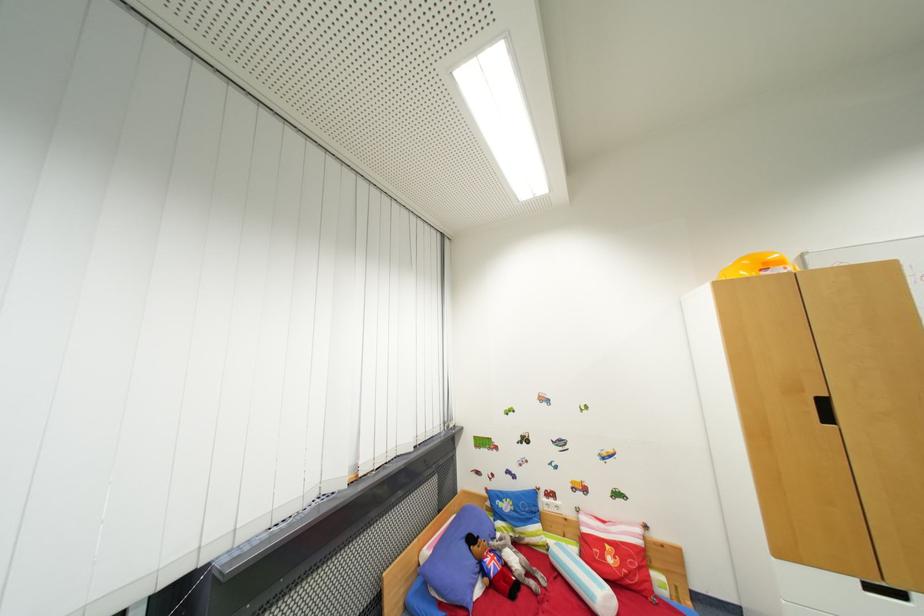
Find where to plugg the white power outlet. Please return your answer as a coordinate pair (x, y).

(551, 505)